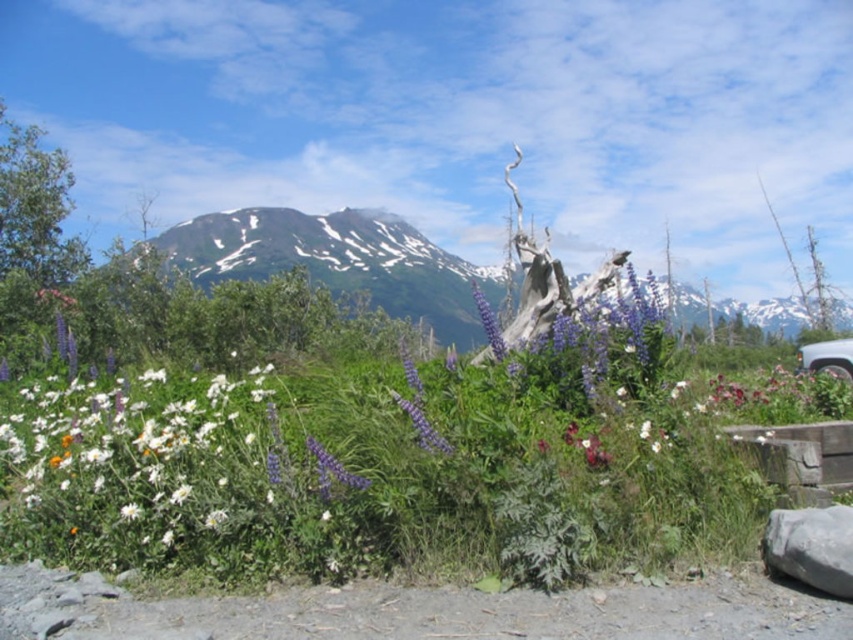
What do you see at coordinates (381, 480) in the screenshot? I see `green leafy grass at center` at bounding box center [381, 480].

From the picture: Between green leafy grass at center and white matte flower at left, which one appears on the right side from the viewer's perspective?

Positioned to the right is green leafy grass at center.

The image size is (853, 640). In order to click on green leafy grass at center in this screenshot , I will do `click(381, 480)`.

Is white matte flower at left thinner than purple matte flower at center?

No, white matte flower at left is not thinner than purple matte flower at center.

Who is positioned more to the right, white matte flower at left or purple matte flower at center?

Positioned to the right is purple matte flower at center.

Describe the element at coordinates (144, 465) in the screenshot. The image size is (853, 640). I see `white matte flower at left` at that location.

Identify the location of white matte flower at left. This screenshot has width=853, height=640. (144, 465).

Consider the image. Who is shorter, green leafy grass at center or purple matte flower at center?

purple matte flower at center

Is point (270, 467) positioned in front of point (310, 451)?

No, it is not.

Find the location of `green leafy grass at center`. green leafy grass at center is located at coordinates click(381, 480).